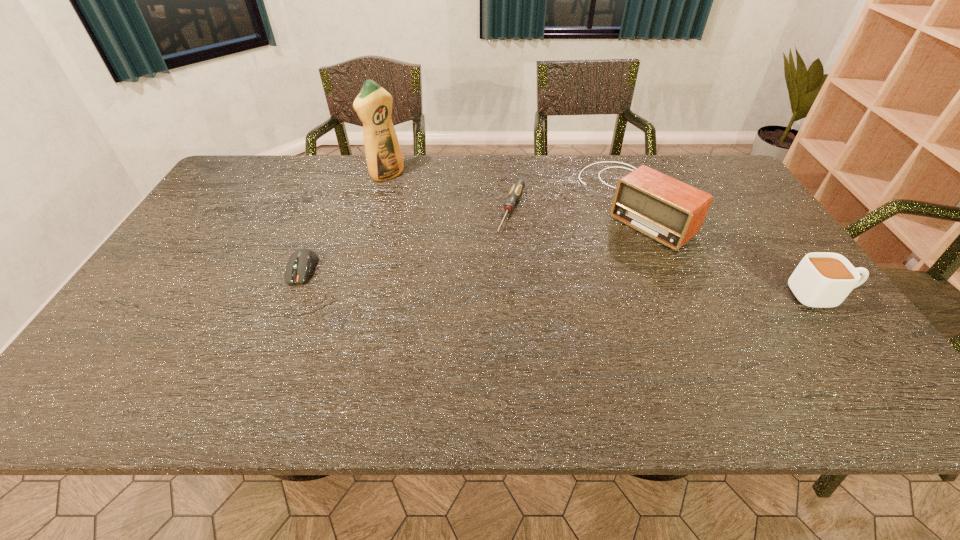
What are the coordinates of `vacant space on the desktop that is between the computer equipment and the cup and is positioned on the label of the detergent` in the screenshot? It's located at (529, 280).

Find the location of a particular element. free space on the desktop that is between the fourth tallest object and the rightmost object and is positioned on the front-facing side of the radio receiver is located at coordinates (522, 280).

Where is `free space on the desktop that is between the computer equipment and the rightmost object and is positioned insert the third object from right to left into a screw head`? free space on the desktop that is between the computer equipment and the rightmost object and is positioned insert the third object from right to left into a screw head is located at coordinates (481, 278).